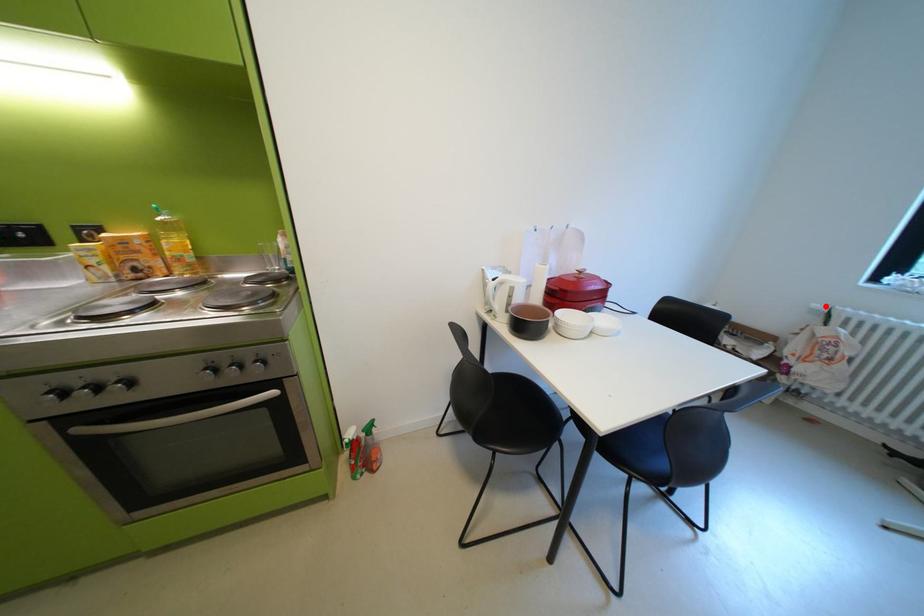
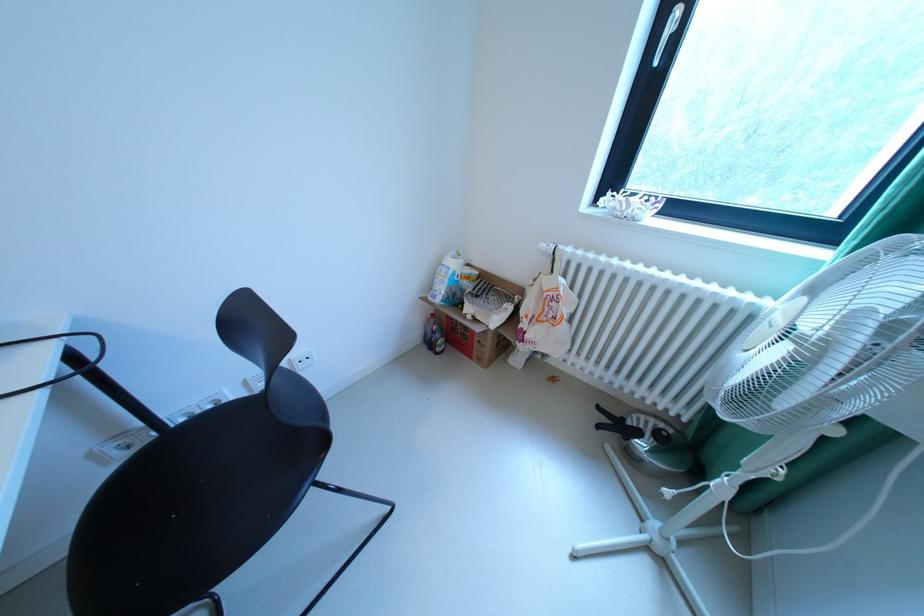
Locate, in the second image, the point that corresponds to the highlighted location in the first image.

(553, 246)